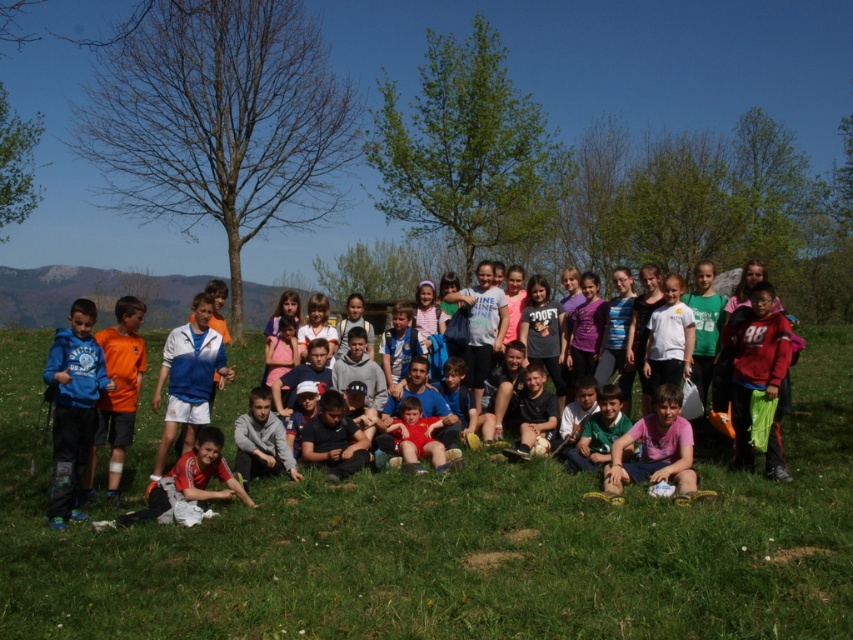
Which of these two, multicolored clothing at center or white jersey at center, stands shorter?

Standing shorter between the two is multicolored clothing at center.

Can you confirm if multicolored clothing at center is positioned below white jersey at center?

Yes, multicolored clothing at center is below white jersey at center.

Is point (138, 493) positioned behind point (206, 323)?

No.

I want to click on multicolored clothing at center, so click(450, 544).

Where is `matte blue hoodie at center`? matte blue hoodie at center is located at coordinates (495, 406).

Can you confirm if matte blue hoodie at center is smaller than blue fleece jacket at lower left?

Yes, matte blue hoodie at center is smaller than blue fleece jacket at lower left.

Locate an element on the screen. This screenshot has height=640, width=853. matte blue hoodie at center is located at coordinates (495, 406).

Who is higher up, matte blue hoodie at center or white jersey at center?

white jersey at center is higher up.

Which is in front, point (520, 356) or point (180, 342)?

Point (180, 342) is more forward.

Locate an element on the screen. The width and height of the screenshot is (853, 640). matte blue hoodie at center is located at coordinates (495, 406).